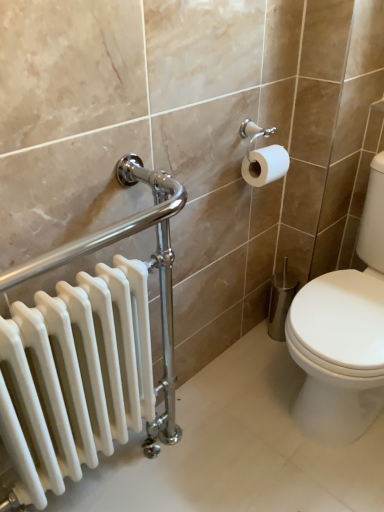
Question: Is white glossy radiator at left taller or shorter than white glossy toilet at right?

Choices:
 (A) tall
 (B) short

Answer: (A)

Question: From the image's perspective, is white glossy radiator at left positioned above or below white glossy toilet at right?

Choices:
 (A) above
 (B) below

Answer: (B)

Question: Which of these objects is positioned farthest from the white glossy radiator at left?

Choices:
 (A) white glossy toilet at right
 (B) white matte toilet paper at upper right

Answer: (B)

Question: Based on their relative distances, which object is farther from the white glossy radiator at left?

Choices:
 (A) white matte toilet paper at upper right
 (B) white glossy toilet at right

Answer: (A)